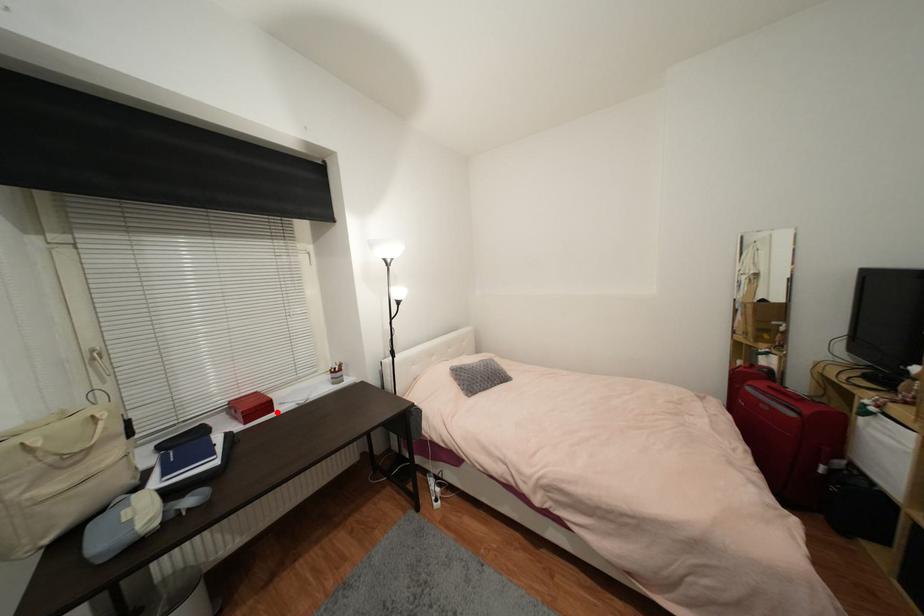
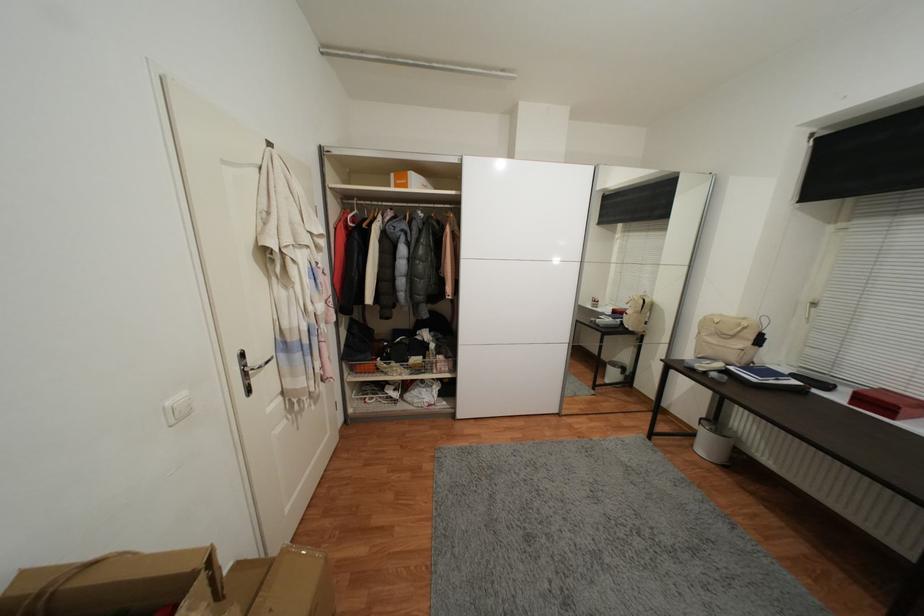
Question: I am providing you with two images of the same scene from different viewpoints. In image1, a red point is highlighted. Considering the same 3D point in image2, which of the following is correct?

Choices:
 (A) It is closer
 (B) It is farther

Answer: (B)